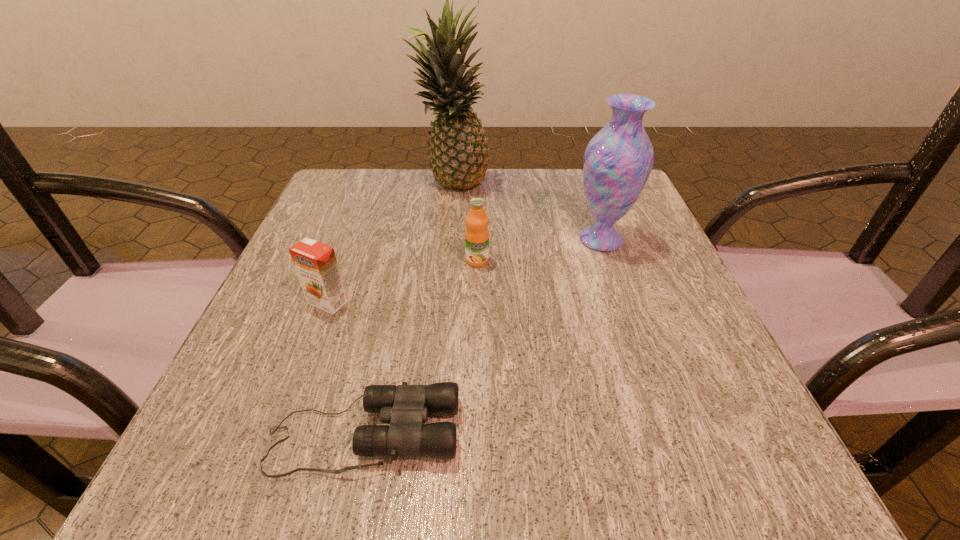
Image resolution: width=960 pixels, height=540 pixels. I want to click on the tallest object, so click(459, 158).

Identify the location of the farthest object. (459, 158).

Locate an element on the screen. the rightmost object is located at coordinates (618, 160).

Locate an element on the screen. vase is located at coordinates (618, 160).

Locate an element on the screen. the farther orange juice is located at coordinates (476, 233).

Locate an element on the screen. The image size is (960, 540). the left orange juice is located at coordinates (315, 262).

At what (x,y) coordinates should I click in order to perform the action: click on the second nearest object. Please return your answer as a coordinate pair (x, y). The image size is (960, 540). Looking at the image, I should click on (315, 262).

Image resolution: width=960 pixels, height=540 pixels. I want to click on the shortest object, so click(x=406, y=407).

This screenshot has height=540, width=960. In order to click on binoculars in this screenshot , I will do `click(406, 407)`.

Locate an element on the screen. The image size is (960, 540). vacant area located 0.350m on the right of the pineapple is located at coordinates (633, 185).